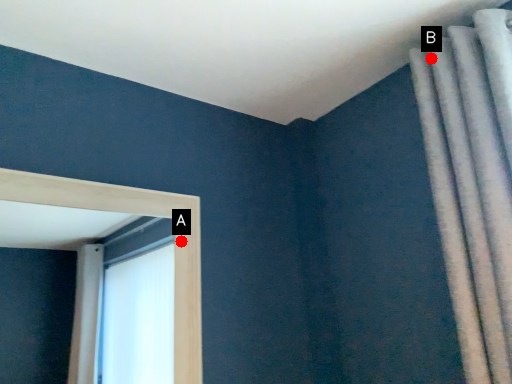
Question: Two points are circled on the image, labeled by A and B beside each circle. Which of the following is the farthest from the observer?

Choices:
 (A) A is further
 (B) B is further

Answer: (A)